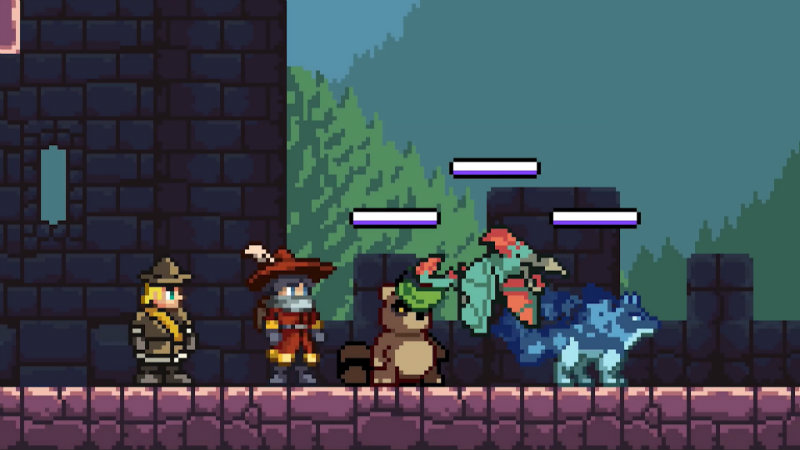
Identify the location of floor. The height and width of the screenshot is (450, 800). (404, 402).